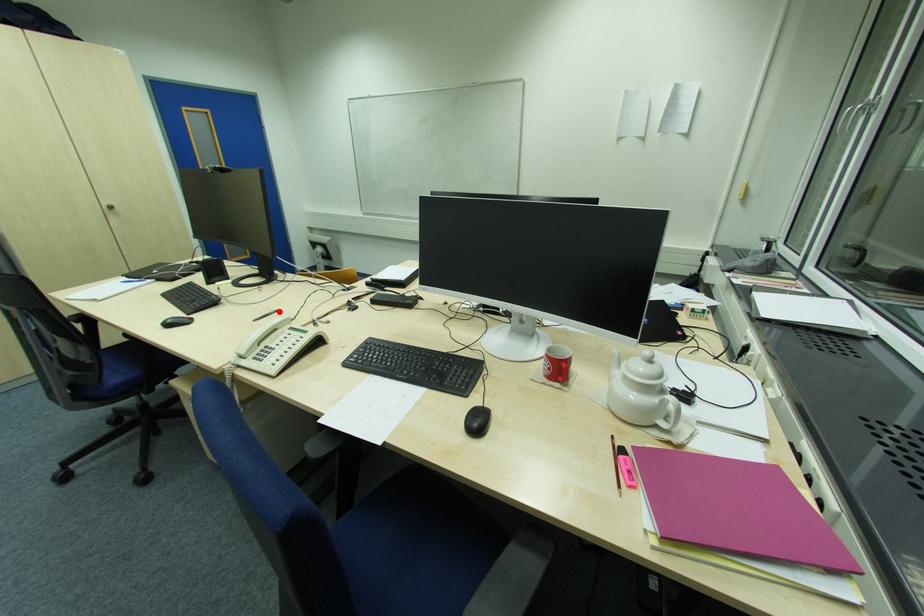
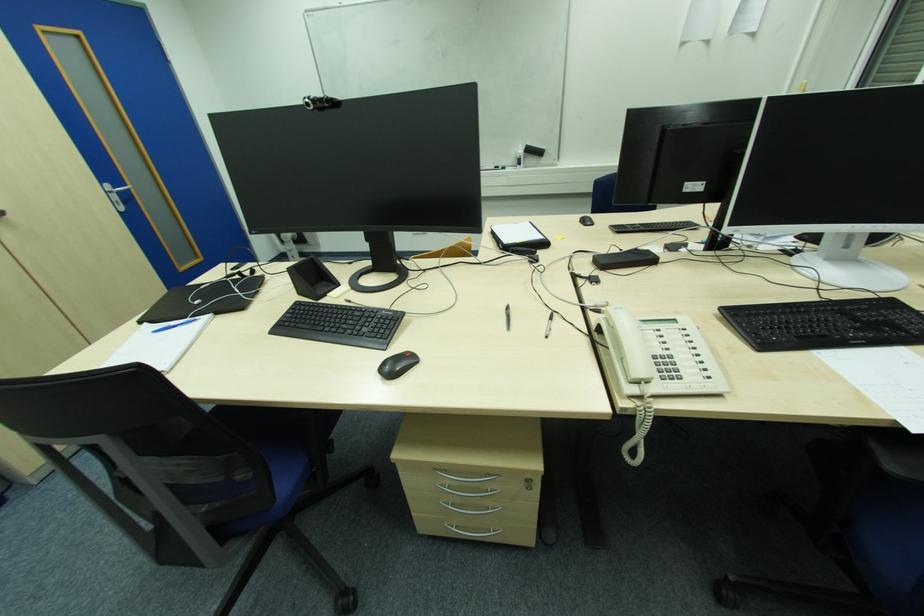
Find the pixel in the second image that matches the highlighted location in the first image.

(509, 309)